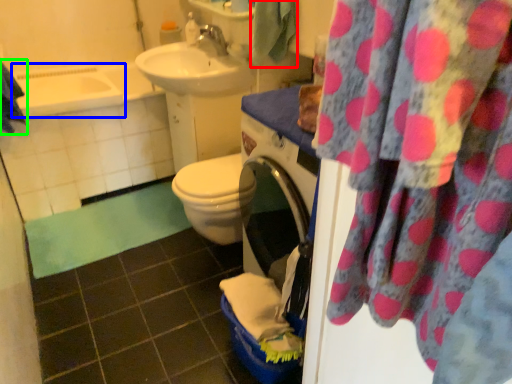
Question: Which is nearer to the beach towel (highlighted by a red box)? bath (highlighted by a blue box) or beach towel (highlighted by a green box).

Choices:
 (A) bath
 (B) beach towel

Answer: (B)